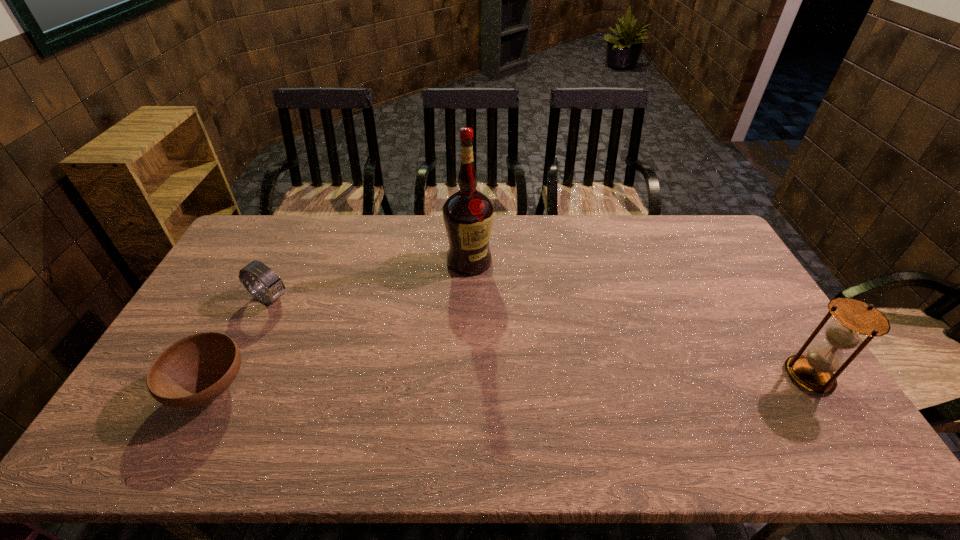
Locate an element on the screen. vacant space on the desktop that is between the bowl and the rightmost object and is positioned on the label of the alcohol is located at coordinates (444, 384).

Locate an element on the screen. vacant space on the desktop that is between the bowl and the hourglass and is positioned on the face of the third tallest object is located at coordinates (445, 383).